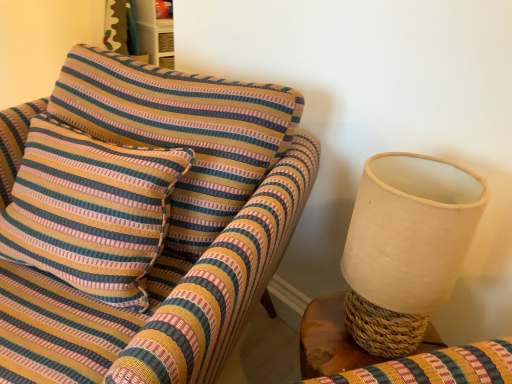
What do you see at coordinates (90, 211) in the screenshot? Image resolution: width=512 pixels, height=384 pixels. I see `striped fabric pillow at left` at bounding box center [90, 211].

Locate an element on the screen. woven wood table at right is located at coordinates (329, 340).

Where is `white fabric lampshade at right`? white fabric lampshade at right is located at coordinates (406, 247).

Who is taller, white fabric lampshade at right or woven wood table at right?

Standing taller between the two is white fabric lampshade at right.

Is white fabric lampshade at right turned away from woven wood table at right?

No, white fabric lampshade at right is not facing away from woven wood table at right.

From the picture: From a real-world perspective, between white fabric lampshade at right and woven wood table at right, who is vertically higher?

white fabric lampshade at right, from a real-world perspective.

Can you confirm if white fabric lampshade at right is thinner than woven wood table at right?

Yes, white fabric lampshade at right is thinner than woven wood table at right.

Is striped fabric pillow at left far away from woven wood table at right?

No, striped fabric pillow at left is in close proximity to woven wood table at right.

Does point (42, 246) come in front of point (317, 313)?

Yes, it is.

Between striped fabric pillow at left and woven wood table at right, which one has larger size?

striped fabric pillow at left is bigger.

Is striped fabric pillow at left further to the viewer compared to woven wood table at right?

No, it is in front of woven wood table at right.

Is striped fabric pillow at left not near white fabric lampshade at right?

Actually, striped fabric pillow at left and white fabric lampshade at right are a little close together.

Between striped fabric pillow at left and white fabric lampshade at right, which one is positioned in front?

Positioned in front is white fabric lampshade at right.

Consider the image. Is striped fabric pillow at left inside the boundaries of white fabric lampshade at right, or outside?

striped fabric pillow at left exists outside the volume of white fabric lampshade at right.

Is striped fabric pillow at left taller or shorter than white fabric lampshade at right?

Clearly, striped fabric pillow at left is taller compared to white fabric lampshade at right.

From the image's perspective, is white fabric lampshade at right over striped fabric pillow at left?

Actually, white fabric lampshade at right appears below striped fabric pillow at left in the image.

Between white fabric lampshade at right and striped fabric pillow at left, which one has less height?

With less height is white fabric lampshade at right.

At what (x,y) coordinates should I click in order to perform the action: click on pillow beneath the white fabric lampshade at right (from a real-world perspective). Please return your answer as a coordinate pair (x, y). Looking at the image, I should click on (90, 211).

Does white fabric lampshade at right have a larger size compared to striped fabric pillow at left?

No.

Considering the sizes of objects woven wood table at right and white fabric lampshade at right in the image provided, who is taller, woven wood table at right or white fabric lampshade at right?

Standing taller between the two is white fabric lampshade at right.

Which object is positioned more to the right, woven wood table at right or white fabric lampshade at right?

white fabric lampshade at right.

From the image's perspective, who appears lower, woven wood table at right or white fabric lampshade at right?

woven wood table at right appears lower in the image.

Is woven wood table at right thinner than white fabric lampshade at right?

No, woven wood table at right is not thinner than white fabric lampshade at right.

In the scene shown: Can you see woven wood table at right touching striped fabric pillow at left?

woven wood table at right is not next to striped fabric pillow at left, and they're not touching.

Would you say woven wood table at right is outside striped fabric pillow at left?

woven wood table at right lies outside striped fabric pillow at left's area.

Which point is more distant from viewer, (310,337) or (69,211)?

Point (310,337)

Is woven wood table at right in front of or behind striped fabric pillow at left in the image?

In the image, woven wood table at right appears behind striped fabric pillow at left.

The width and height of the screenshot is (512, 384). What are the coordinates of `table lamp above the woven wood table at right (from a real-world perspective)` in the screenshot? It's located at (406, 247).

At what (x,y) coordinates should I click in order to perform the action: click on table located on the right of striped fabric pillow at left. Please return your answer as a coordinate pair (x, y). The height and width of the screenshot is (384, 512). Looking at the image, I should click on (329, 340).

From the image, which object appears to be farther from striped fabric pillow at left, white fabric lampshade at right or woven wood table at right?

white fabric lampshade at right is further to striped fabric pillow at left.

Which object lies nearer to the anchor point white fabric lampshade at right, striped fabric pillow at left or woven wood table at right?

woven wood table at right.

Which object lies nearer to the anchor point striped fabric pillow at left, woven wood table at right or white fabric lampshade at right?

woven wood table at right is positioned closer to the anchor striped fabric pillow at left.

Based on their spatial positions, is striped fabric pillow at left or white fabric lampshade at right further from woven wood table at right?

striped fabric pillow at left is positioned further to the anchor woven wood table at right.

Based on their spatial positions, is woven wood table at right or striped fabric pillow at left further from white fabric lampshade at right?

striped fabric pillow at left is further to white fabric lampshade at right.

Estimate the real-world distances between objects in this image. Which object is further from woven wood table at right, white fabric lampshade at right or striped fabric pillow at left?

Among the two, striped fabric pillow at left is located further to woven wood table at right.

The width and height of the screenshot is (512, 384). I want to click on table between striped fabric pillow at left and white fabric lampshade at right in the horizontal direction, so click(x=329, y=340).